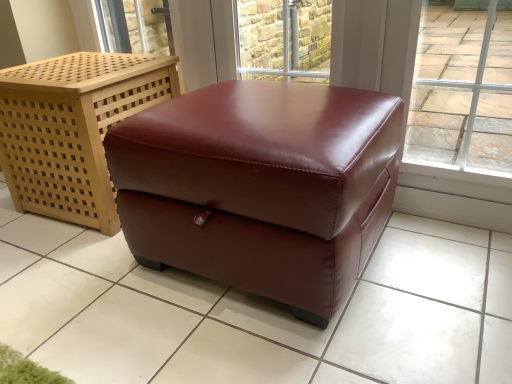
Locate an element on the screen. The height and width of the screenshot is (384, 512). vacant area that lies in front of burgundy leather ottoman at center is located at coordinates (66, 268).